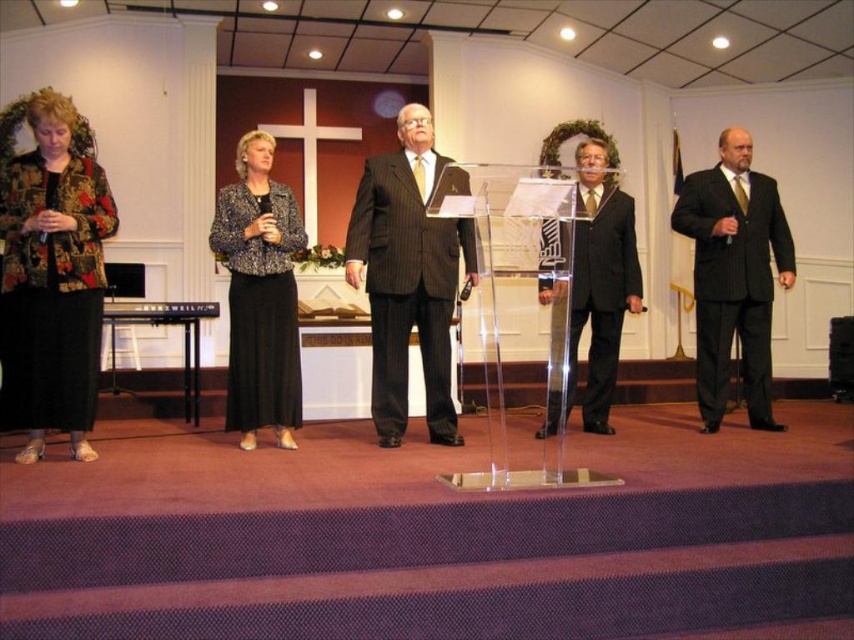
Who is positioned more to the right, pinstriped suit at center or matte black suit at center?

Positioned to the right is matte black suit at center.

Who is taller, pinstriped suit at center or matte black suit at center?

With more height is pinstriped suit at center.

Between point (452, 259) and point (557, 392), which one is positioned behind?

Point (452, 259)

The image size is (854, 640). In order to click on pinstriped suit at center in this screenshot , I will do `click(408, 275)`.

Is floral-patterned fabric jacket at left thinner than pinstriped suit at center?

Yes.

Identify the location of floral-patterned fabric jacket at left. (51, 273).

Is matte black suit at right wider than matte black suit at center?

In fact, matte black suit at right might be narrower than matte black suit at center.

Can you confirm if matte black suit at right is taller than matte black suit at center?

Yes, matte black suit at right is taller than matte black suit at center.

You are a GUI agent. You are given a task and a screenshot of the screen. Output one action in this format:
    pyautogui.click(x=<x>, y=<y>)
    Task: Click on the matte black suit at right
    Image resolution: width=854 pixels, height=640 pixels.
    Given the screenshot: What is the action you would take?
    pyautogui.click(x=734, y=275)